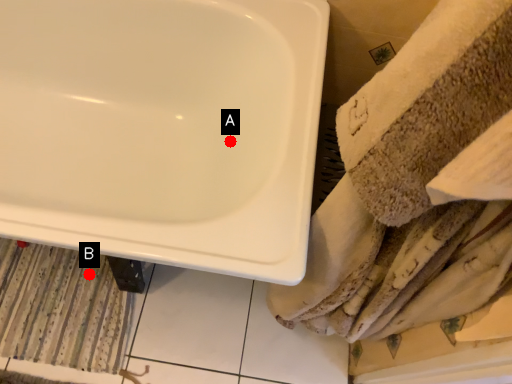
Question: Two points are circled on the image, labeled by A and B beside each circle. Which of the following is the farthest from the observer?

Choices:
 (A) A is further
 (B) B is further

Answer: (B)